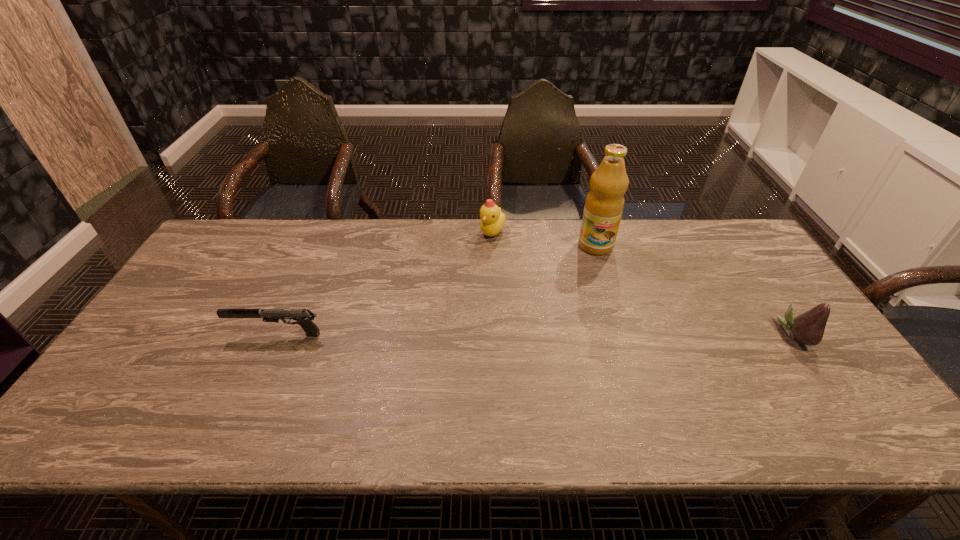
Where is `free spot on the desktop that is between the gun and the rightmost object and is positioned on the front-facing side of the duckling`? The image size is (960, 540). free spot on the desktop that is between the gun and the rightmost object and is positioned on the front-facing side of the duckling is located at coordinates (473, 334).

This screenshot has width=960, height=540. Identify the location of free space on the desktop that is between the gun and the rightmost object and is positioned on the label of the third object from left to right. (608, 334).